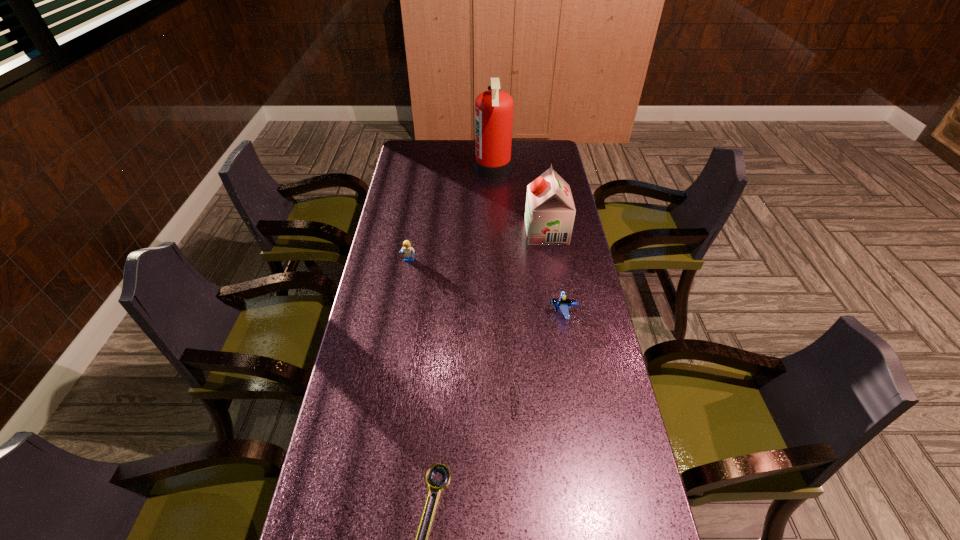
The image size is (960, 540). I want to click on fire extinguisher, so click(493, 109).

Find the location of `the tallest object`. the tallest object is located at coordinates (493, 109).

The height and width of the screenshot is (540, 960). What are the coordinates of `soya milk` in the screenshot? It's located at (550, 211).

The image size is (960, 540). I want to click on the fifth shortest object, so point(550,211).

What are the coordinates of `the left Lego` in the screenshot? It's located at tap(408, 250).

Where is `the third farthest object`? The width and height of the screenshot is (960, 540). the third farthest object is located at coordinates (408, 250).

The width and height of the screenshot is (960, 540). I want to click on the right Lego, so click(564, 304).

Locate an element on the screen. This screenshot has height=540, width=960. the shorter Lego is located at coordinates (564, 304).

The image size is (960, 540). I want to click on the second shortest object, so click(514, 381).

Where is `sunglasses`? sunglasses is located at coordinates [x=514, y=381].